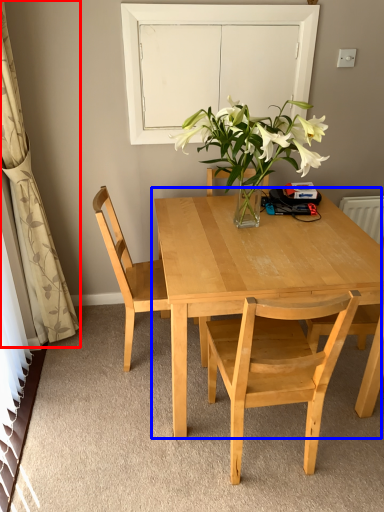
Question: Which object appears farthest to the camera in this image, curtain (highlighted by a red box) or kitchen & dining room table (highlighted by a blue box)?

Choices:
 (A) curtain
 (B) kitchen & dining room table

Answer: (B)